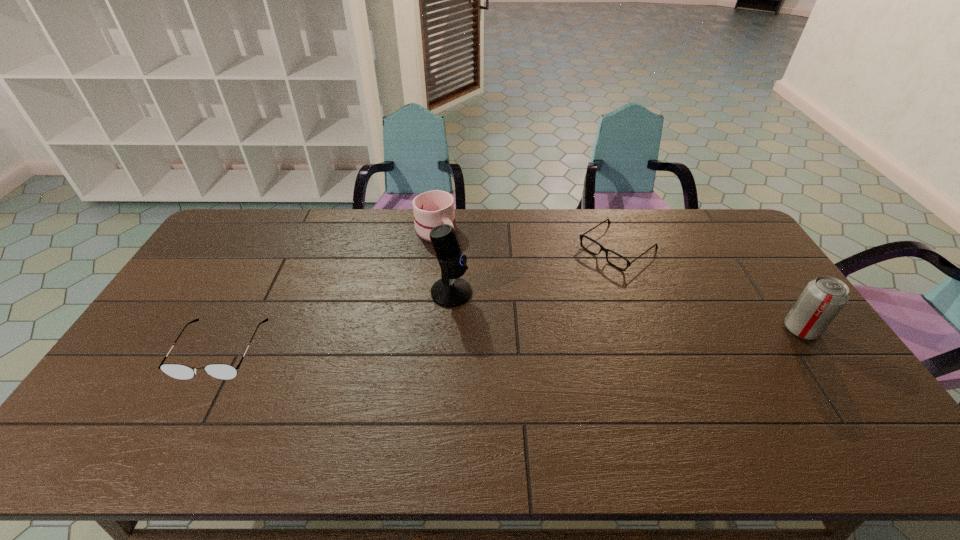
Where is `the left spectacles`? The height and width of the screenshot is (540, 960). the left spectacles is located at coordinates (179, 371).

Identify the location of the taller spectacles. The height and width of the screenshot is (540, 960). [x=179, y=371].

Find the location of a particular element. soda can is located at coordinates (823, 298).

Where is `the fourth shortest object`? The image size is (960, 540). the fourth shortest object is located at coordinates (823, 298).

Where is `microphone`? The height and width of the screenshot is (540, 960). microphone is located at coordinates (451, 291).

The image size is (960, 540). What are the coordinates of `the tallest object` in the screenshot? It's located at (451, 291).

At what (x,y) coordinates should I click in order to perform the action: click on the shortest object. Please return your answer as a coordinate pair (x, y). This screenshot has width=960, height=540. Looking at the image, I should click on (581, 236).

Image resolution: width=960 pixels, height=540 pixels. In order to click on the shorter spectacles in this screenshot , I will do pos(581,236).

You are a GUI agent. You are given a task and a screenshot of the screen. Output one action in this format:
    pyautogui.click(x=<x>, y=<y>)
    Task: Click on the third tallest object
    The height and width of the screenshot is (540, 960).
    Given the screenshot: What is the action you would take?
    [x=433, y=208]

I want to click on vacant space located 0.100m on the lenses of the leftmost object, so click(186, 415).